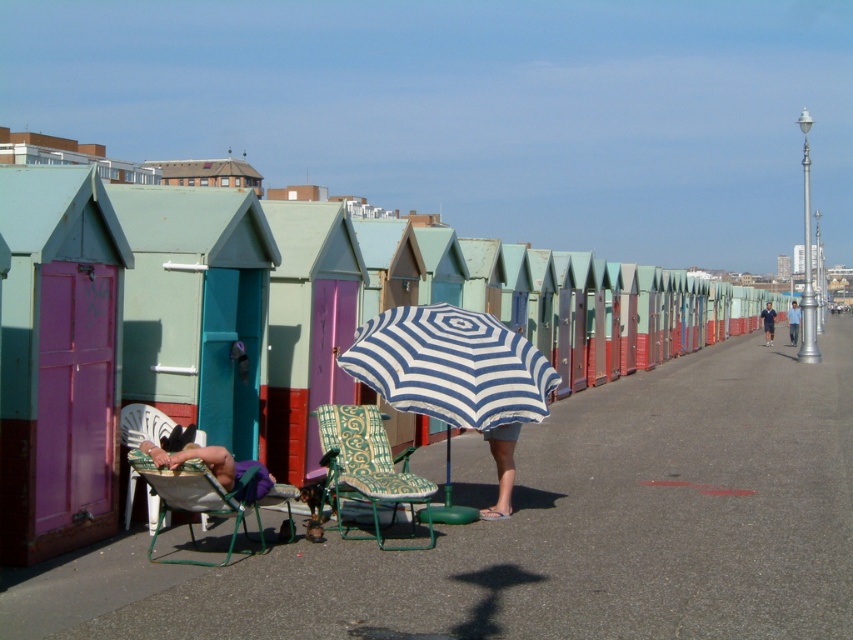
Which of these two, purple wood beach hut at left or green fabric chair at lower left, stands taller?

With more height is purple wood beach hut at left.

This screenshot has height=640, width=853. Describe the element at coordinates (57, 362) in the screenshot. I see `purple wood beach hut at left` at that location.

This screenshot has width=853, height=640. Find the location of `purple wood beach hut at left`. purple wood beach hut at left is located at coordinates (57, 362).

Between green fabric beach chair at center and dark blue jeans at far right, which one appears on the left side from the viewer's perspective?

From the viewer's perspective, green fabric beach chair at center appears more on the left side.

Does green fabric beach chair at center appear under dark blue jeans at far right?

Correct, green fabric beach chair at center is located below dark blue jeans at far right.

Locate an element on the screen. green fabric beach chair at center is located at coordinates (368, 468).

Does blue striped umbrella at center have a lesser width compared to green fabric beach chair at center?

No.

Can you confirm if blue striped umbrella at center is positioned to the left of green fabric beach chair at center?

No, blue striped umbrella at center is not to the left of green fabric beach chair at center.

Is point (403, 337) in front of point (405, 461)?

No, (403, 337) is further to viewer.

Find the location of `blue striped umbrella at center`. blue striped umbrella at center is located at coordinates (456, 376).